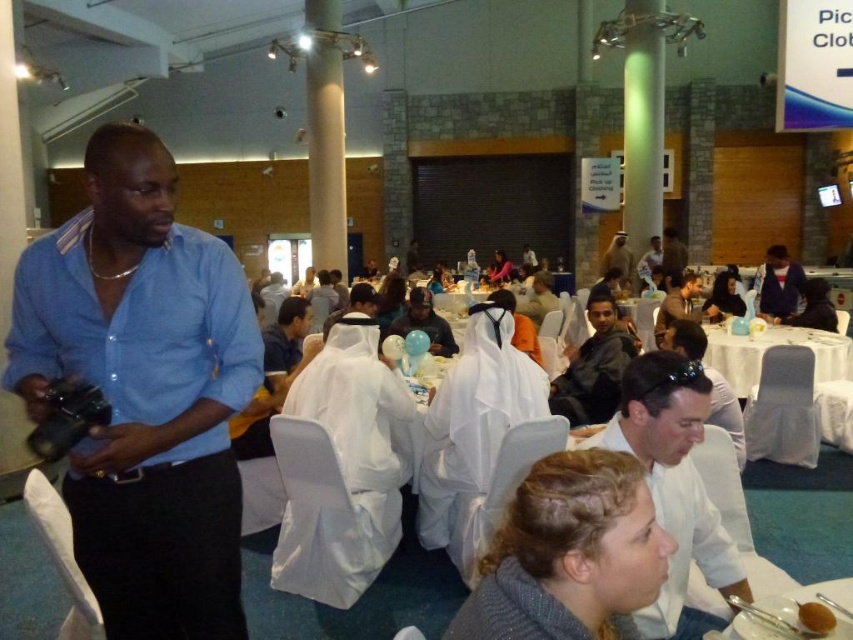
Question: Is dark gray fabric jacket at center smaller than white fabric headscarf at center?

Choices:
 (A) yes
 (B) no

Answer: (B)

Question: Which point is farther to the camera?

Choices:
 (A) (704, 529)
 (B) (785, 260)

Answer: (B)

Question: Among these points, which one is farthest from the camera?

Choices:
 (A) (746, 576)
 (B) (831, 625)
 (C) (780, 262)
 (D) (524, 308)

Answer: (C)

Question: Which point appears closest to the camera in this image?

Choices:
 (A) (68, 232)
 (B) (798, 301)
 (C) (595, 294)
 (D) (289, 365)

Answer: (A)

Question: Can you confirm if white glossy table at center is positioned above white glossy plate at lower right?

Choices:
 (A) no
 (B) yes

Answer: (B)

Question: Does white glossy plate at lower right appear on the right side of white glossy shirt at center?

Choices:
 (A) no
 (B) yes

Answer: (A)